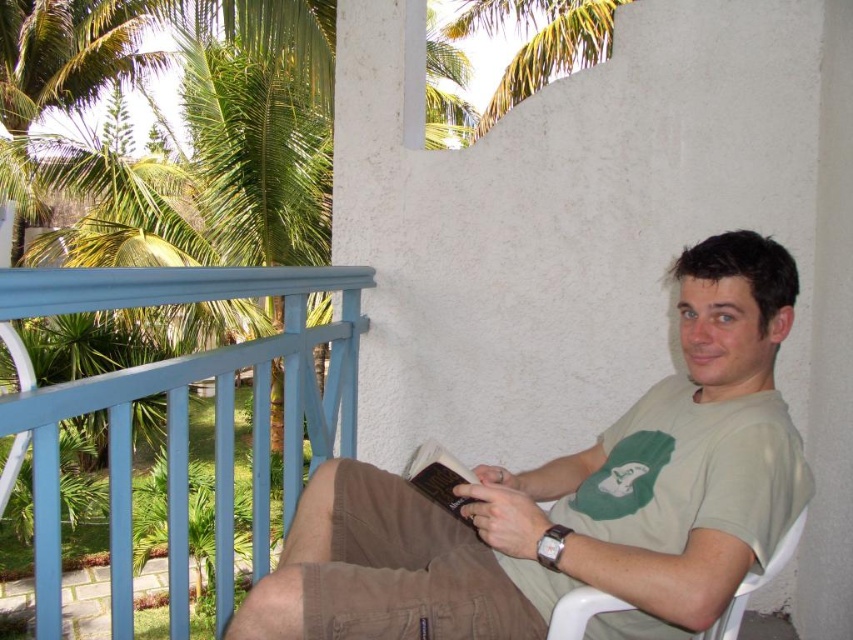
Which is more to the left, white plastic chair at right or hardcover book at center?

Positioned to the left is hardcover book at center.

Can you confirm if white plastic chair at right is positioned to the right of hardcover book at center?

Yes, white plastic chair at right is to the right of hardcover book at center.

The width and height of the screenshot is (853, 640). What do you see at coordinates (755, 582) in the screenshot?
I see `white plastic chair at right` at bounding box center [755, 582].

Where is `white plastic chair at right`? white plastic chair at right is located at coordinates (755, 582).

Is green cotton t-shirt at center closer to camera compared to white plastic chair at right?

Yes, green cotton t-shirt at center is in front of white plastic chair at right.

Is green cotton t-shirt at center bigger than white plastic chair at right?

Correct, green cotton t-shirt at center is larger in size than white plastic chair at right.

This screenshot has width=853, height=640. In order to click on green cotton t-shirt at center in this screenshot , I will do `click(573, 499)`.

Identify the location of green cotton t-shirt at center. This screenshot has height=640, width=853. (573, 499).

Does blue painted wood railing at left have a greater width compared to hardcover book at center?

Yes, blue painted wood railing at left is wider than hardcover book at center.

Locate an element on the screen. The width and height of the screenshot is (853, 640). blue painted wood railing at left is located at coordinates click(x=183, y=413).

Identify the location of blue painted wood railing at left. 183,413.